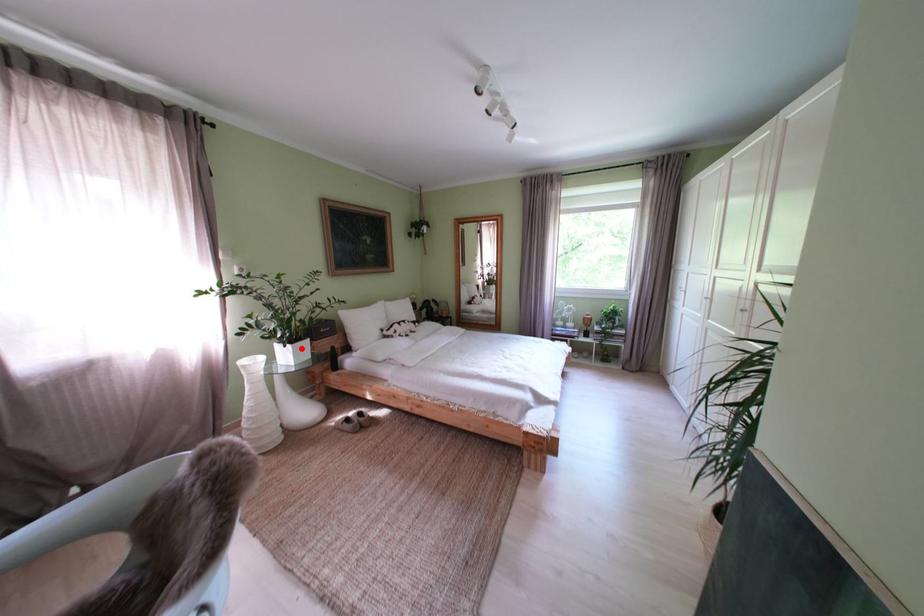
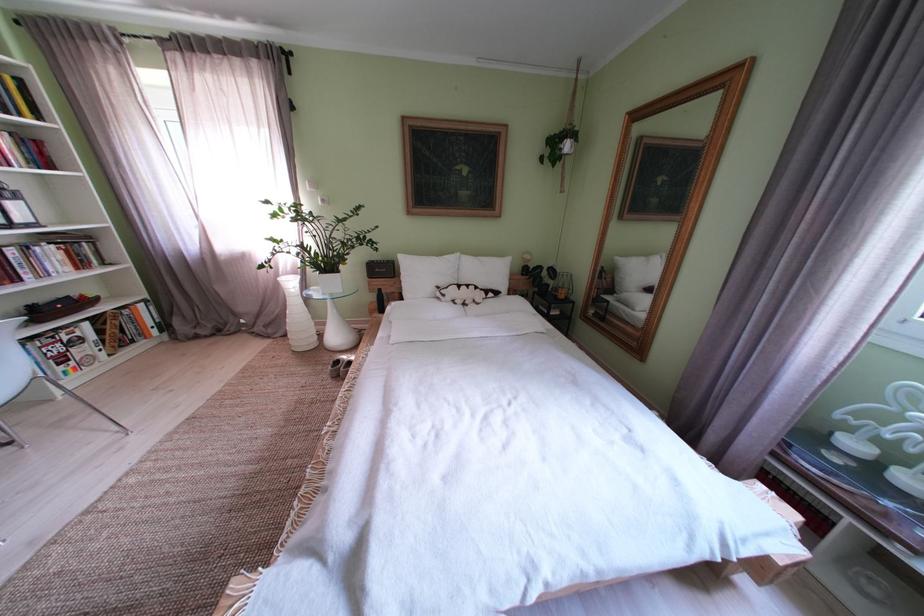
Where in the second image is the point corresponding to the highlighted location from the first image?

(333, 278)